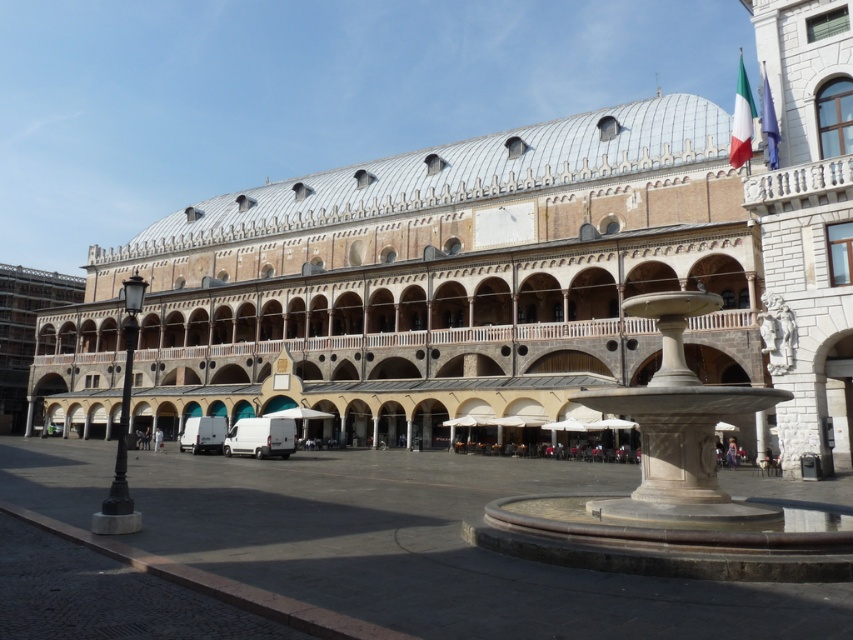
You are standing in the plaza facing the building. There are two points marked on the ground in front of you. The first point is at coordinates point (200,314) and the second is at point (672,496). Which point is closer to you?

Point (200,314) is closer to you because it is further to the viewer than point (672,496).

You are standing in the plaza and want to take a photo of the beige stone palace at center and the white marble fountain at center. If you face the palace, which direction should you turn to include both in the frame?

Since the beige stone palace at center is to the left of the white marble fountain at center, you should turn to your right to include both in the frame.